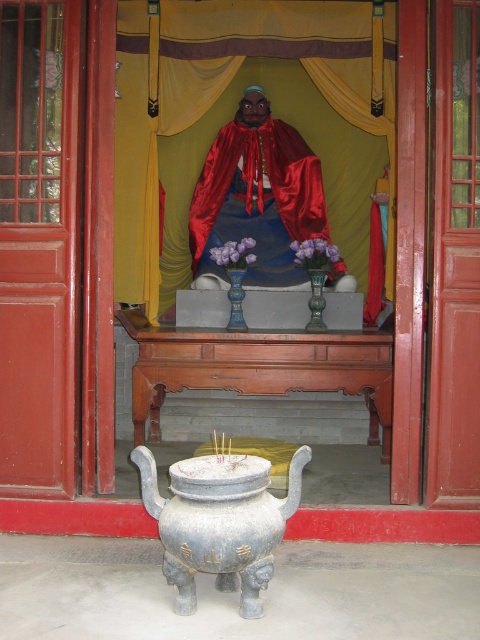
You are a temple visitor who wants to place an offering on the wooden altar at center. However, there is a gray stone incense burner at center in the way. Can you move the incense burner to make space?

The wooden altar at center is bigger than the gray stone incense burner at center, so there is enough space to move the gray stone incense burner at center aside and place your offering on the wooden altar at center.

You are a visitor at the temple and want to place a small offering on the altar. The shiny red fabric monk at center and the gray stone incense burner at center are both on the altar. Which object should you avoid placing your offering near if you want it to be more noticeable?

You should avoid placing your offering near the shiny red fabric monk at center because it is larger in size than the gray stone incense burner at center, making it more dominant and likely drawing more attention.